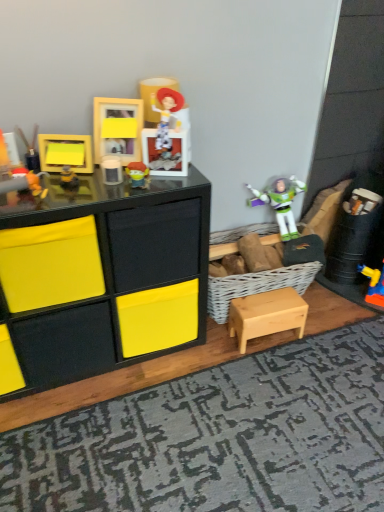
You are a GUI agent. You are given a task and a screenshot of the screen. Output one action in this format:
    pyautogui.click(x=<x>, y=<y>)
    Task: Click on the free space in front of matte black toy at left, placed as the fifth toy when sorted from right to left
    
    Given the screenshot: What is the action you would take?
    pyautogui.click(x=25, y=203)